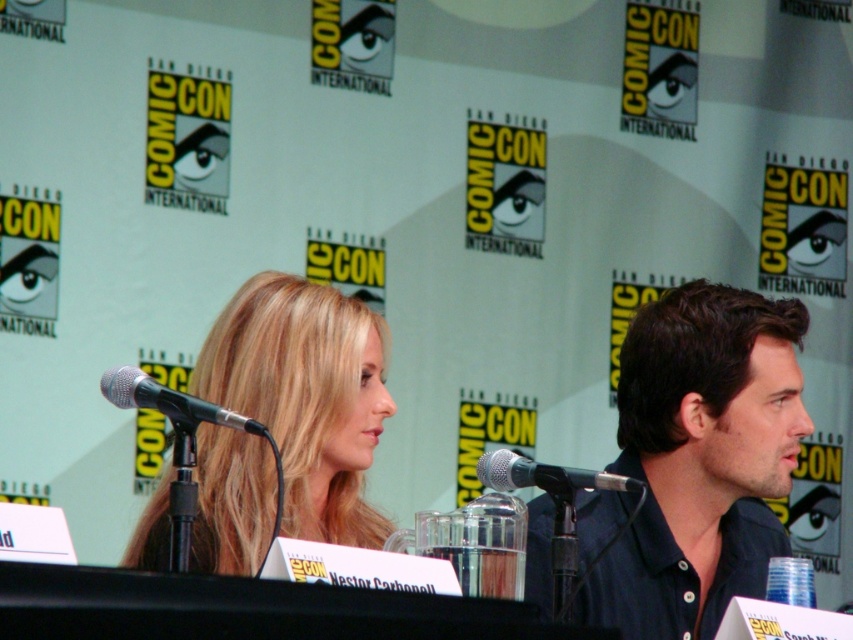
Question: Which object appears closest to the camera in this image?

Choices:
 (A) silver metallic microphone at left
 (B) blonde hair at center

Answer: (A)

Question: Among these points, which one is farthest from the camera?

Choices:
 (A) coord(135,371)
 (B) coord(270,304)
 (C) coord(490,456)

Answer: (B)

Question: In this image, where is dark blue shirt at right located relative to silver metallic microphone at left?

Choices:
 (A) left
 (B) right

Answer: (B)

Question: Considering the real-world distances, which object is closest to the dark blue shirt at right?

Choices:
 (A) black metallic microphone at center
 (B) blonde hair at center

Answer: (B)

Question: Where is blonde hair at center located in relation to black metallic microphone at center in the image?

Choices:
 (A) left
 (B) right

Answer: (A)

Question: From the image, what is the correct spatial relationship of dark blue shirt at right in relation to black metallic microphone at center?

Choices:
 (A) left
 (B) right

Answer: (B)